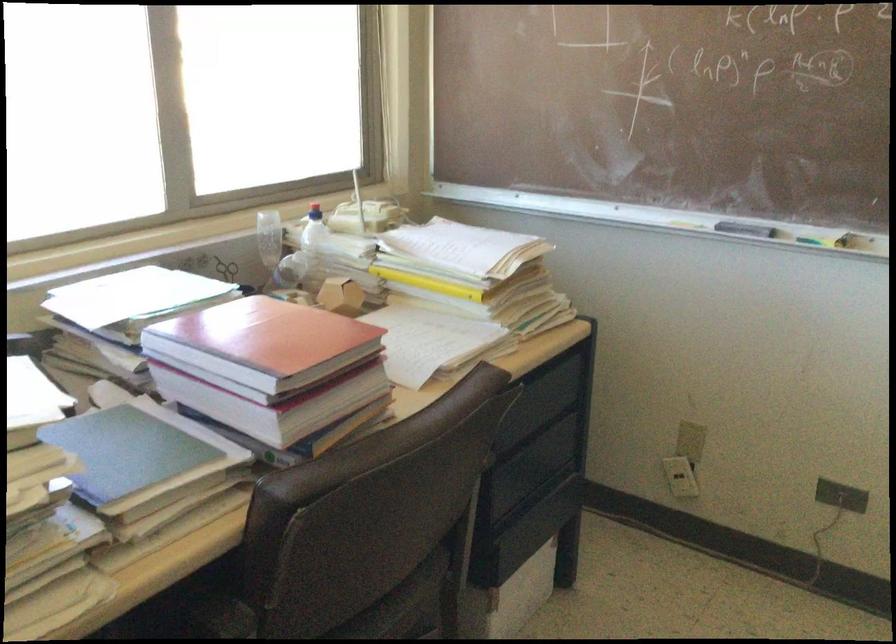
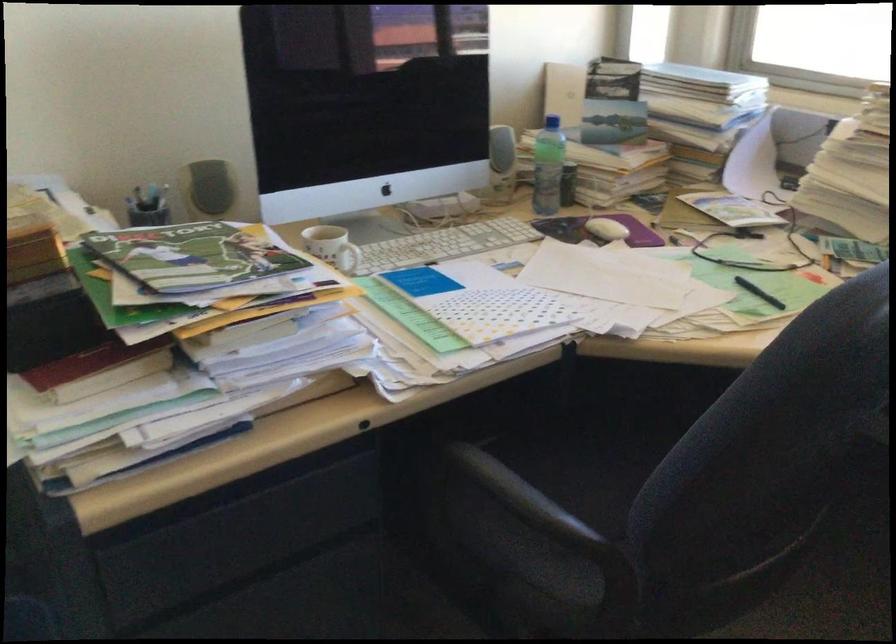
Based on the continuous images, in which direction is the camera rotating?

The camera rotated toward left-down.